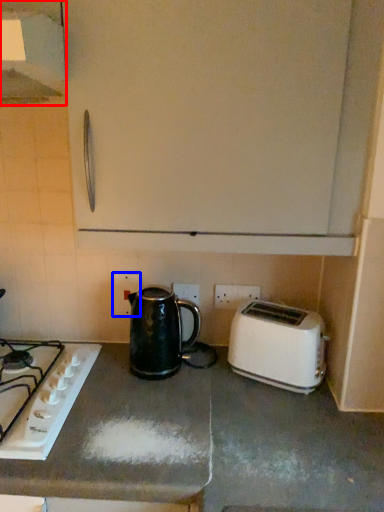
Question: Among these objects, which one is nearest to the camera, exhaust hood (highlighted by a red box) or electric outlet (highlighted by a blue box)?

Choices:
 (A) exhaust hood
 (B) electric outlet

Answer: (A)